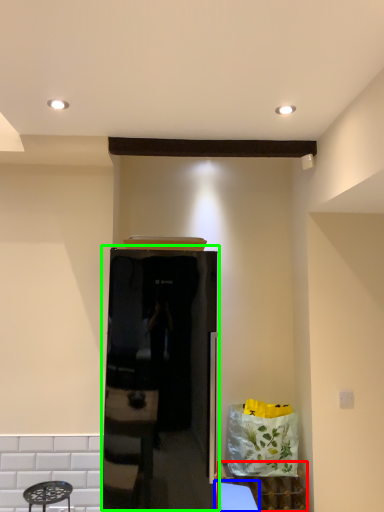
Question: Which is farther away from cabinetry (highlighted by a red box)? table (highlighted by a blue box) or appliance (highlighted by a green box)?

Choices:
 (A) table
 (B) appliance

Answer: (B)